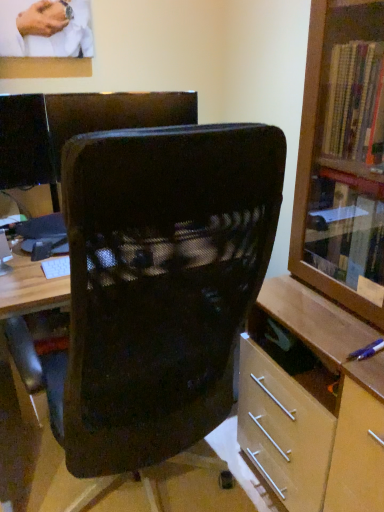
Where is `wooden cabinet at right`? wooden cabinet at right is located at coordinates (326, 285).

This screenshot has height=512, width=384. What do you see at coordinates (326, 285) in the screenshot?
I see `wooden cabinet at right` at bounding box center [326, 285].

Measure the distance between point (292, 340) and camera.

Point (292, 340) is 4.26 feet away from camera.

This screenshot has height=512, width=384. Describe the element at coordinates (157, 287) in the screenshot. I see `black mesh chair at center` at that location.

I want to click on black mesh chair at center, so click(x=157, y=287).

At what (x,y) coordinates should I click in order to perform the action: click on wooden cabinet at right. Please return your answer as a coordinate pair (x, y). The width and height of the screenshot is (384, 512). Looking at the image, I should click on (326, 285).

Which is more to the right, wooden cabinet at right or black mesh chair at center?

Positioned to the right is wooden cabinet at right.

Between wooden cabinet at right and black mesh chair at center, which one is positioned in front?

wooden cabinet at right is closer to the camera.

Which is less distant, (302,207) or (205,304)?

Point (302,207) appears to be farther away from the viewer than point (205,304).

From the image's perspective, would you say wooden cabinet at right is positioned over black mesh chair at center?

Indeed, from the image's perspective, wooden cabinet at right is shown above black mesh chair at center.

From a real-world perspective, which is physically below, wooden cabinet at right or black mesh chair at center?

black mesh chair at center, from a real-world perspective.

Considering the sizes of objects wooden cabinet at right and black mesh chair at center in the image provided, who is wider, wooden cabinet at right or black mesh chair at center?

black mesh chair at center.

Can you confirm if wooden cabinet at right is taller than black mesh chair at center?

Yes, wooden cabinet at right is taller than black mesh chair at center.

Between wooden cabinet at right and black mesh chair at center, which one has larger size?

Bigger between the two is black mesh chair at center.

Is wooden cabinet at right completely or partially outside of black mesh chair at center?

Indeed, wooden cabinet at right is completely outside black mesh chair at center.

Is wooden cabinet at right not close to black mesh chair at center?

No, wooden cabinet at right is in close proximity to black mesh chair at center.

From the picture: Is wooden cabinet at right oriented towards black mesh chair at center?

Yes, wooden cabinet at right is aimed at black mesh chair at center.

The height and width of the screenshot is (512, 384). Find the location of `chair on the left of wooden cabinet at right`. chair on the left of wooden cabinet at right is located at coordinates (157, 287).

Does black mesh chair at center appear on the right side of wooden cabinet at right?

In fact, black mesh chair at center is to the left of wooden cabinet at right.

Which object is further away from the camera taking this photo, black mesh chair at center or wooden cabinet at right?

black mesh chair at center.

Does point (214, 338) come behind point (355, 143)?

No, it is not.

From the image's perspective, is black mesh chair at center below wooden cabinet at right?

Yes, from the image's perspective, black mesh chair at center is below wooden cabinet at right.

From a real-world perspective, who is located lower, black mesh chair at center or wooden cabinet at right?

In real-world perspective, black mesh chair at center is lower.

Between black mesh chair at center and wooden cabinet at right, which one has larger width?

Wider between the two is black mesh chair at center.

Between black mesh chair at center and wooden cabinet at right, which one has more height?

Standing taller between the two is wooden cabinet at right.

Can you confirm if black mesh chair at center is smaller than wooden cabinet at right?

No.

Is wooden cabinet at right surrounded by black mesh chair at center?

Definitely not — wooden cabinet at right is not inside black mesh chair at center.

Would you consider black mesh chair at center to be distant from wooden cabinet at right?

No, there isn't a large distance between black mesh chair at center and wooden cabinet at right.

Could you tell me if black mesh chair at center is facing wooden cabinet at right?

No, black mesh chair at center is not turned towards wooden cabinet at right.

How much distance is there between black mesh chair at center and wooden cabinet at right?

The distance of black mesh chair at center from wooden cabinet at right is 16.11 inches.

Locate an element on the screen. The width and height of the screenshot is (384, 512). chair below the wooden cabinet at right (from the image's perspective) is located at coordinates (157, 287).

What are the coordinates of `chair on the left of wooden cabinet at right` in the screenshot? It's located at (157, 287).

In the image, there is a wooden cabinet at right. Where is `chair below it (from a real-world perspective)`? chair below it (from a real-world perspective) is located at coordinates 157,287.